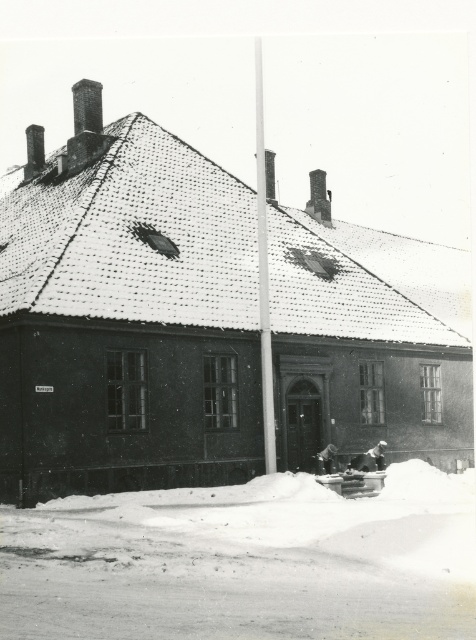
Question: Which of the following is the farthest from the observer?

Choices:
 (A) (257, 77)
 (B) (446, 621)

Answer: (A)

Question: Which of the following is the closest to the observer?

Choices:
 (A) smooth white pole at center
 (B) white powdery snow at lower center

Answer: (B)

Question: Is white powdery snow at lower center closer to camera compared to smooth white pole at center?

Choices:
 (A) yes
 (B) no

Answer: (A)

Question: In this image, where is white powdery snow at lower center located relative to smooth white pole at center?

Choices:
 (A) above
 (B) below

Answer: (B)

Question: Does white powdery snow at lower center have a greater width compared to smooth white pole at center?

Choices:
 (A) yes
 (B) no

Answer: (A)